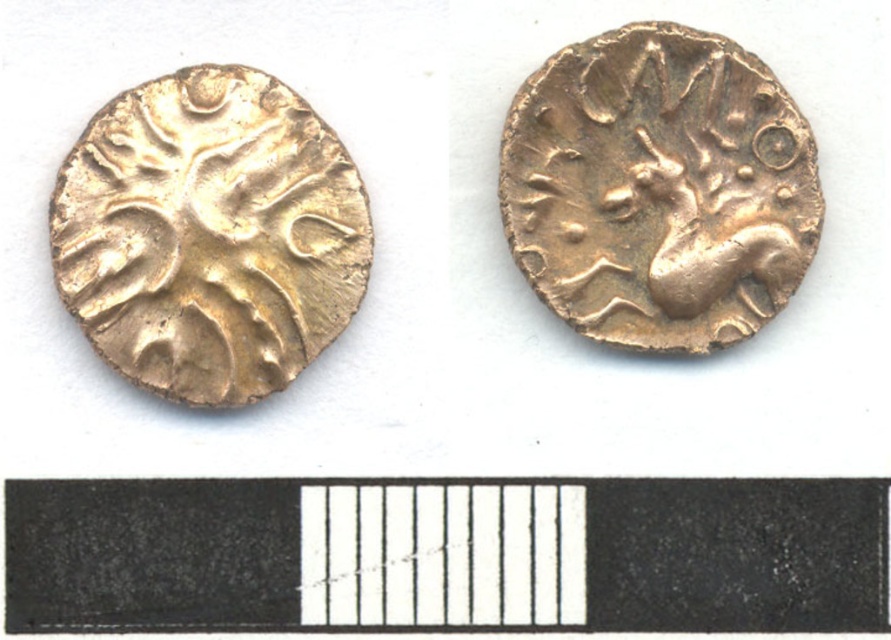
Between point (765, 216) and point (121, 134), which one is positioned in front?

Point (121, 134) is in front.

Does gold textured horse at upper right have a larger size compared to gold textured coin at left?

No.

In order to click on gold textured horse at upper right in this screenshot , I will do `click(659, 188)`.